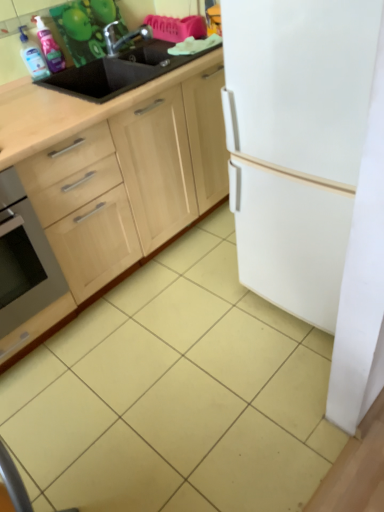
Question: Is wooden cabinet at center positioned with its back to white matte refrigerator at right?

Choices:
 (A) no
 (B) yes

Answer: (A)

Question: Considering the relative positions of wooden cabinet at center and white matte refrigerator at right in the image provided, is wooden cabinet at center to the left of white matte refrigerator at right from the viewer's perspective?

Choices:
 (A) yes
 (B) no

Answer: (A)

Question: From a real-world perspective, is wooden cabinet at center physically below white matte refrigerator at right?

Choices:
 (A) yes
 (B) no

Answer: (A)

Question: Is wooden cabinet at center positioned before white matte refrigerator at right?

Choices:
 (A) yes
 (B) no

Answer: (B)

Question: Can white matte refrigerator at right be found inside wooden cabinet at center?

Choices:
 (A) no
 (B) yes

Answer: (A)

Question: In terms of width, does wooden cabinet at center look wider or thinner when compared to yellow matte tile at lower left?

Choices:
 (A) thin
 (B) wide

Answer: (B)

Question: Considering the positions of wooden cabinet at center and yellow matte tile at lower left in the image, is wooden cabinet at center taller or shorter than yellow matte tile at lower left?

Choices:
 (A) short
 (B) tall

Answer: (B)

Question: Considering the positions of point (198, 172) and point (49, 458), is point (198, 172) closer or farther from the camera than point (49, 458)?

Choices:
 (A) closer
 (B) farther

Answer: (B)

Question: Do you think wooden cabinet at center is within yellow matte tile at lower left, or outside of it?

Choices:
 (A) outside
 (B) inside

Answer: (A)

Question: Is white matte refrigerator at right to the left or to the right of stainless steel oven at lower left in the image?

Choices:
 (A) left
 (B) right

Answer: (B)

Question: From the image's perspective, is white matte refrigerator at right positioned above or below stainless steel oven at lower left?

Choices:
 (A) below
 (B) above

Answer: (B)

Question: In terms of width, does white matte refrigerator at right look wider or thinner when compared to stainless steel oven at lower left?

Choices:
 (A) wide
 (B) thin

Answer: (A)

Question: Considering their positions, is white matte refrigerator at right located in front of or behind stainless steel oven at lower left?

Choices:
 (A) behind
 (B) front

Answer: (B)

Question: From a real-world perspective, relative to translucent plastic spray bottle at upper left, marked as the first cleaning product in a right-to-left arrangement, is black matte sink at upper left vertically above or below?

Choices:
 (A) above
 (B) below

Answer: (B)

Question: Considering the positions of point (122, 99) and point (51, 58), is point (122, 99) closer or farther from the camera than point (51, 58)?

Choices:
 (A) farther
 (B) closer

Answer: (B)